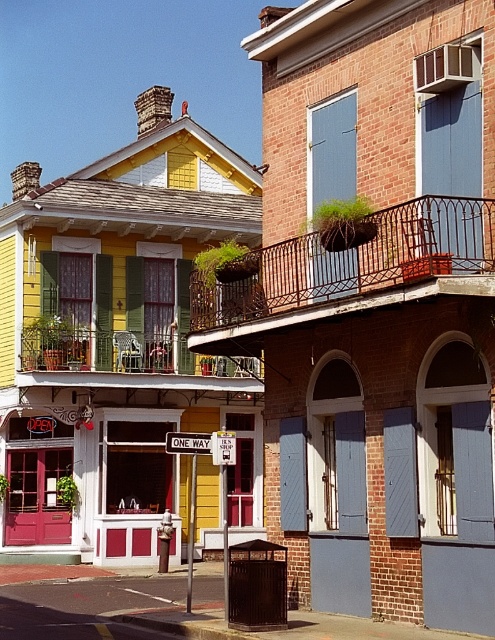
Question: Can you confirm if rustic wrought iron balcony at upper center is positioned to the right of brick balcony at upper right?

Choices:
 (A) yes
 (B) no

Answer: (B)

Question: Which point is farther to the camera?

Choices:
 (A) gray wood shutter at center
 (B) blue painted wood at center

Answer: (B)

Question: Which point appears closest to the camera in this image?

Choices:
 (A) (186, 344)
 (B) (330, 124)
 (C) (396, 456)
 (D) (195, 300)

Answer: (C)

Question: Which point is closer to the camera?

Choices:
 (A) click(466, 284)
 (B) click(391, 424)
 (C) click(430, 51)
 (D) click(45, 369)

Answer: (A)

Question: Considering the relative positions of blue painted wood at center and brick balcony at upper right in the image provided, where is blue painted wood at center located with respect to brick balcony at upper right?

Choices:
 (A) right
 (B) left

Answer: (B)

Question: In this image, where is rustic wrought iron balcony at upper center located relative to green wrought iron balcony at center?

Choices:
 (A) below
 (B) above

Answer: (B)